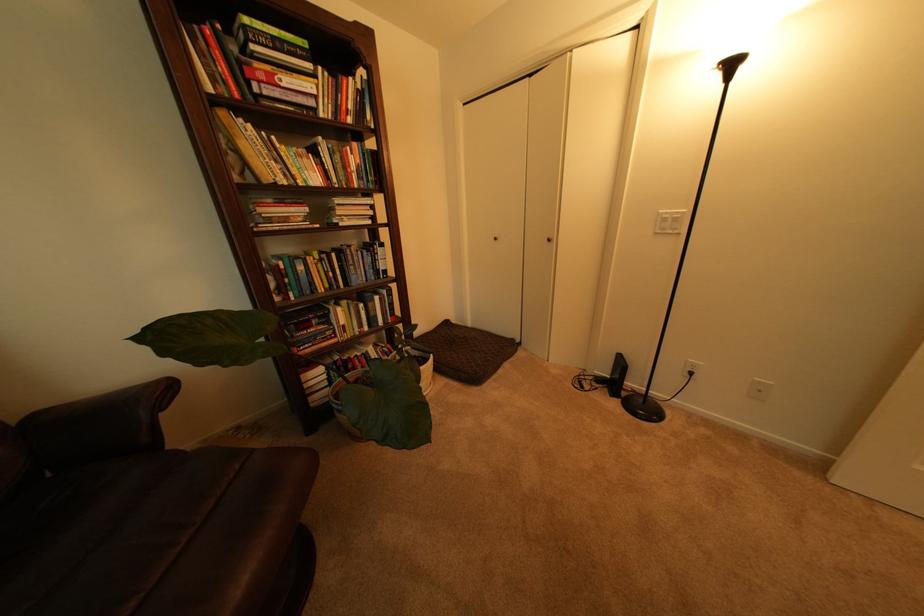
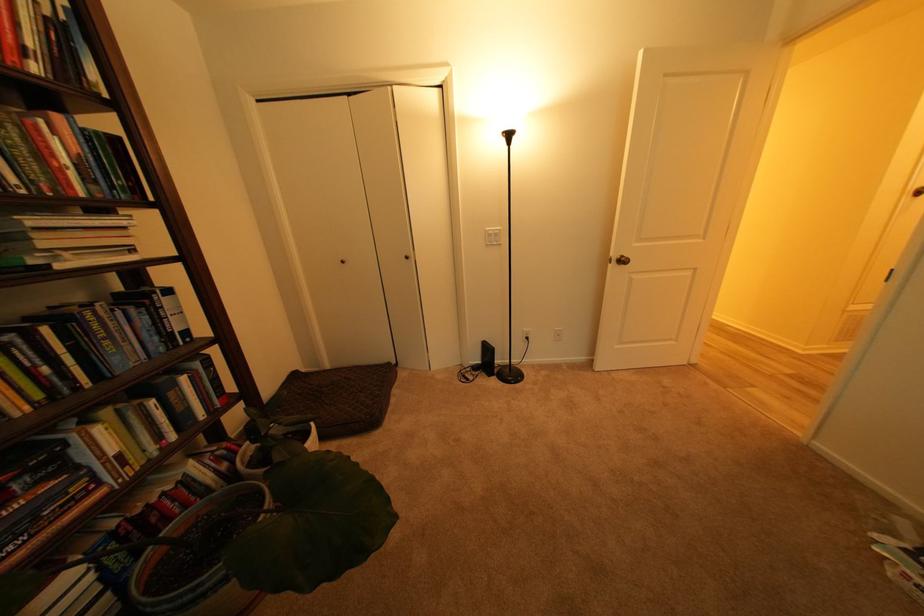
Question: The camera is either moving clockwise (left) or counter-clockwise (right) around the object. The first image is from the beginning of the video and the second image is from the end. Is the camera moving left or right when shooting the video?

Choices:
 (A) Left
 (B) Right

Answer: (A)